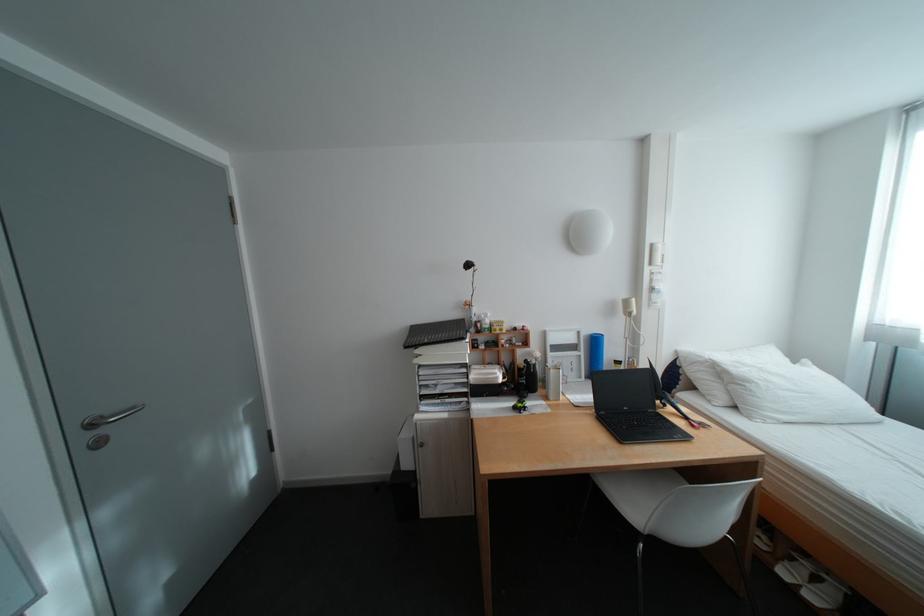
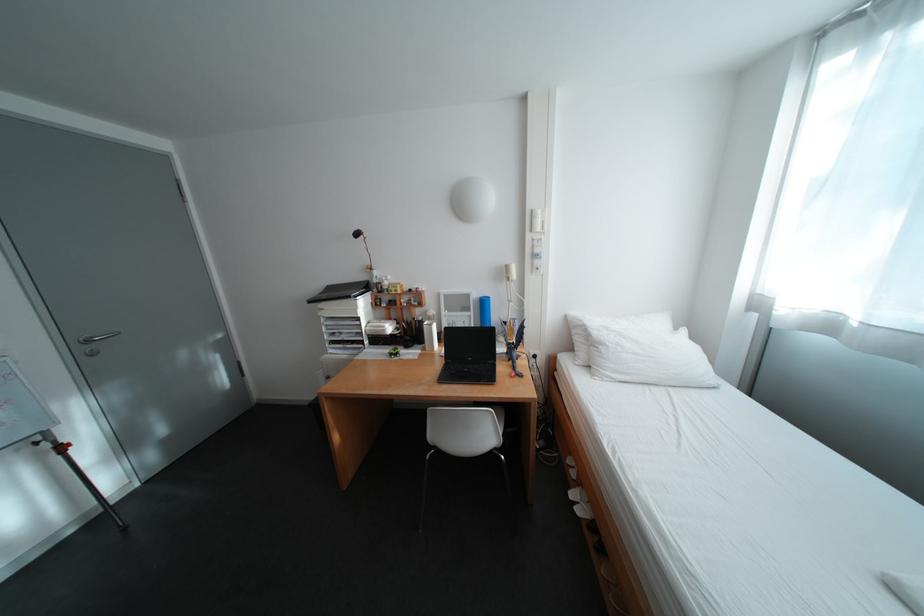
Locate, in the second image, the point that corresponds to (x=660, y=270) in the first image.

(541, 237)